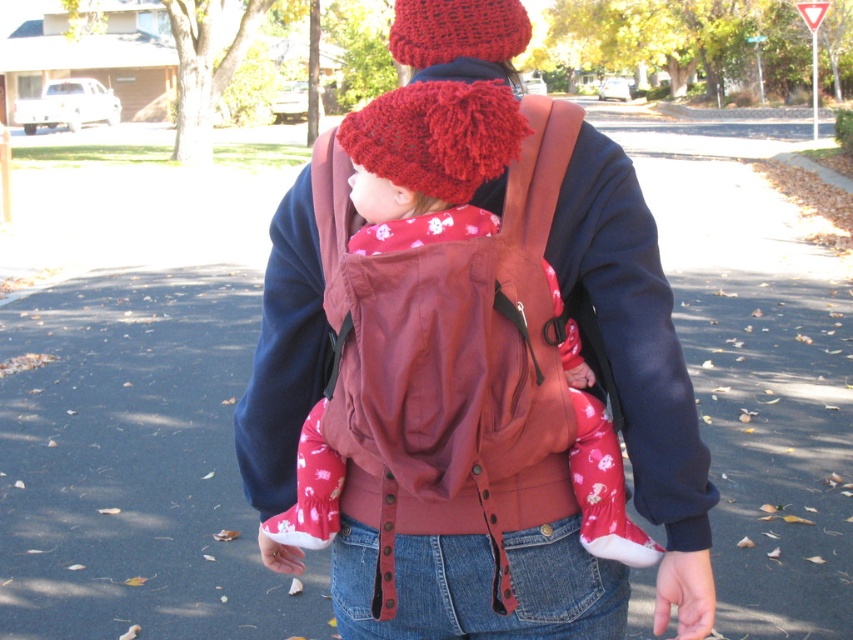
Question: Among these points, which one is farthest from the camera?

Choices:
 (A) (514, 17)
 (B) (438, 275)
 (C) (462, 182)

Answer: (A)

Question: Does red knitted hat at center have a lesser width compared to knitted woolen hat at upper center?

Choices:
 (A) yes
 (B) no

Answer: (B)

Question: Among these points, which one is farthest from the camera?

Choices:
 (A) (437, 36)
 (B) (543, 496)
 (C) (514, 102)

Answer: (A)

Question: Does matte brown baby carrier at center appear on the left side of knitted woolen hat at upper center?

Choices:
 (A) no
 (B) yes

Answer: (A)

Question: Which point appears closest to the camera in this image?

Choices:
 (A) (418, 35)
 (B) (477, 429)

Answer: (B)

Question: Is matte brown baby carrier at center wider than knitted woolen hat at upper center?

Choices:
 (A) no
 (B) yes

Answer: (B)